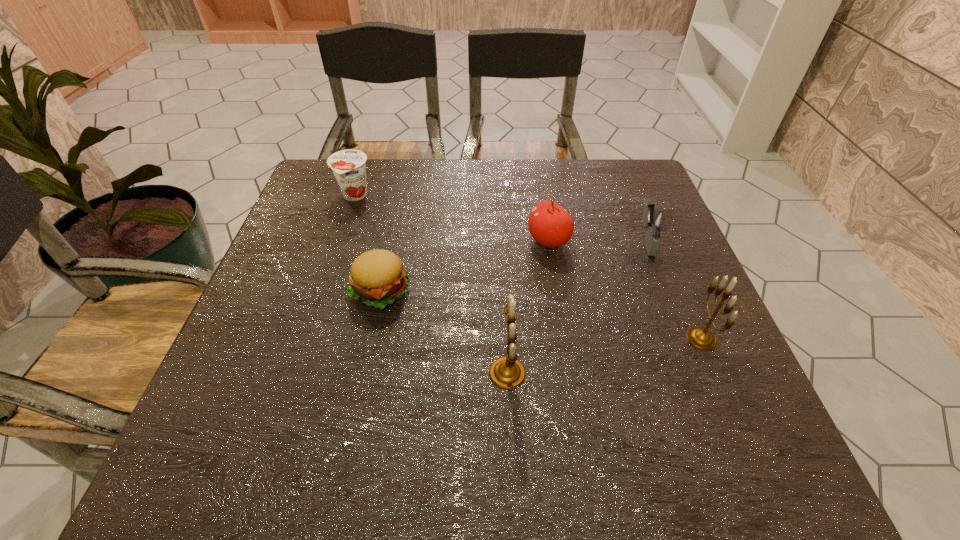
With all candelabrums evenly spaced, where should an extra candelabrum be placed on the left to continue the pattern? Please point out a vacant space. Please provide its 2D coordinates. Your answer should be formatted as a tuple, i.e. [(x, y)], where the tuple contains the x and y coordinates of a point satisfying the conditions above.

[(286, 412)]